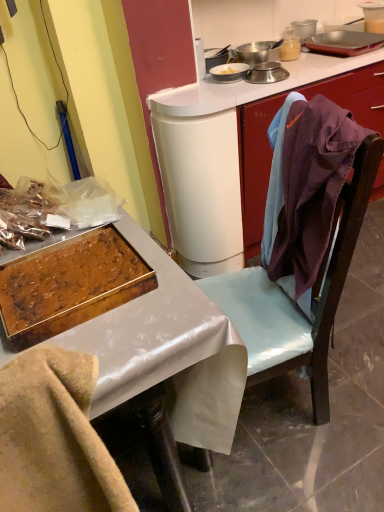
Question: Is metallic silver scale at upper center, the third appliance positioned from the top, in front of or behind shiny brown tray at lower left in the image?

Choices:
 (A) behind
 (B) front

Answer: (A)

Question: Which is correct: metallic silver scale at upper center, the 1th appliance positioned from the bottom, is inside shiny brown tray at lower left, or outside of it?

Choices:
 (A) outside
 (B) inside

Answer: (A)

Question: Which is farther from the translucent glass jar at upper center, placed as the first appliance when sorted from top to bottom?

Choices:
 (A) shiny brown tray at lower left
 (B) metallic silver scale at upper center, the third appliance positioned from the top
 (C) metallic silver pot at upper center, which is the second appliance from bottom to top
 (D) brown wooden tray at lower left
 (E) metallic tray at left

Answer: (D)

Question: Estimate the real-world distances between objects in this image. Which object is farther from the shiny brown tray at lower left?

Choices:
 (A) metallic tray at left
 (B) metallic silver scale at upper center, the third appliance positioned from the top
 (C) purple fabric at right
 (D) metallic silver pot at upper center, marked as the second appliance in a top-to-bottom arrangement
 (E) translucent glass jar at upper center, the 3th appliance in the bottom-to-top sequence

Answer: (E)